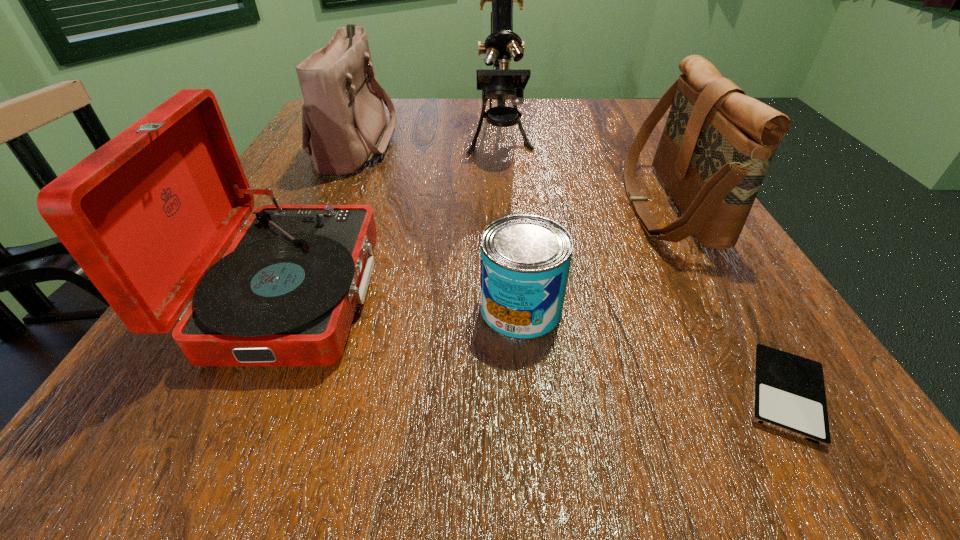
This screenshot has width=960, height=540. Find the location of `unoccupied position between the phonograph_record and the tallest object`. unoccupied position between the phonograph_record and the tallest object is located at coordinates (396, 216).

Identify the location of empty location between the microscope and the right shoulder bag. The height and width of the screenshot is (540, 960). (584, 173).

At what (x,y) coordinates should I click in order to perform the action: click on free point between the fifth tallest object and the left shoulder bag. Please return your answer as a coordinate pair (x, y). The height and width of the screenshot is (540, 960). Looking at the image, I should click on (439, 226).

The image size is (960, 540). Find the location of `free space between the left shoulder bag and the shortest object`. free space between the left shoulder bag and the shortest object is located at coordinates (571, 268).

In order to click on empty space between the microscope and the right shoulder bag in this screenshot , I will do `click(584, 173)`.

Find the location of a particular element. This screenshot has width=960, height=540. empty location between the phonograph_record and the second shortest object is located at coordinates (406, 301).

Image resolution: width=960 pixels, height=540 pixels. I want to click on object that stands as the second closest to the tallest object, so click(x=344, y=126).

Identify which object is the fourth closest to the shortest object. Please provide its 2D coordinates. Your answer should be formatted as a tuple, i.e. [(x, y)], where the tuple contains the x and y coordinates of a point satisfying the conditions above.

[(501, 83)]

Image resolution: width=960 pixels, height=540 pixels. Find the location of `free point that satisfies the following two spatial constraints: 1. through the eyepiece of the microscope; 2. on the front-facing side of the phonograph_record`. free point that satisfies the following two spatial constraints: 1. through the eyepiece of the microscope; 2. on the front-facing side of the phonograph_record is located at coordinates (511, 292).

Locate an element on the screen. vacant space that satisfies the following two spatial constraints: 1. on the front-facing side of the right shoulder bag; 2. on the left side of the iPod is located at coordinates (776, 394).